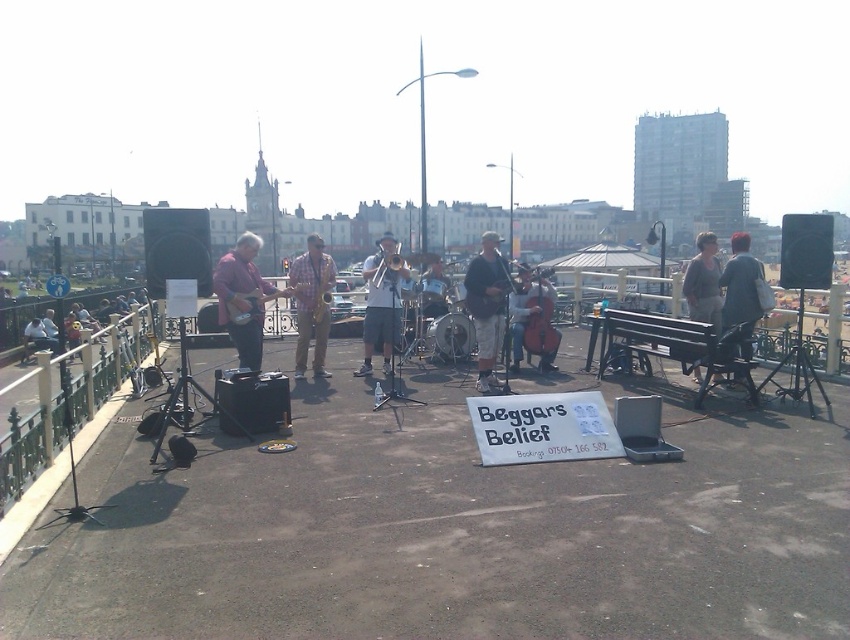
You are a photographer trying to capture both the checkered fabric saxophone at center and the satin gold saxophone at center in a single shot. Which saxophone will appear larger in the photo?

The checkered fabric saxophone at center will appear larger in the photo because it is closer to the viewer than the satin gold saxophone at center.

You are a photographer trying to capture the band members and their instruments. You notice the denim jacket at right and the brushed metal saxophone at center. Which object is taller?

The denim jacket at right is taller than the brushed metal saxophone at center.

You are a photographer trying to capture a shot of both the brushed metal saxophone at center and the satin gold saxophone at center. From which side of the saxophones should you position yourself to ensure both are visible in the frame?

You should position yourself to the left of the saxophones because the brushed metal saxophone at center is to the right of the satin gold saxophone at center, so standing on the left side will allow you to see both instruments in the frame.